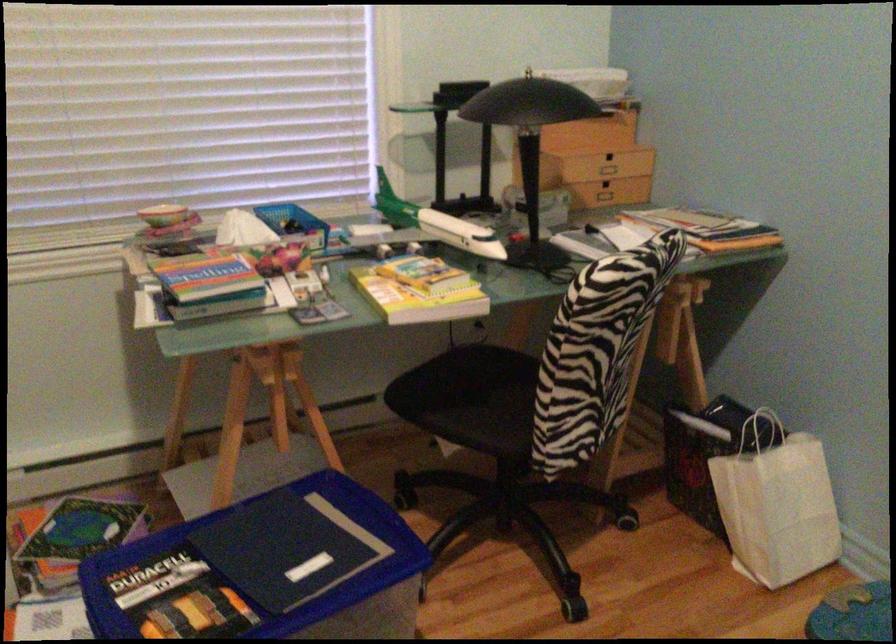
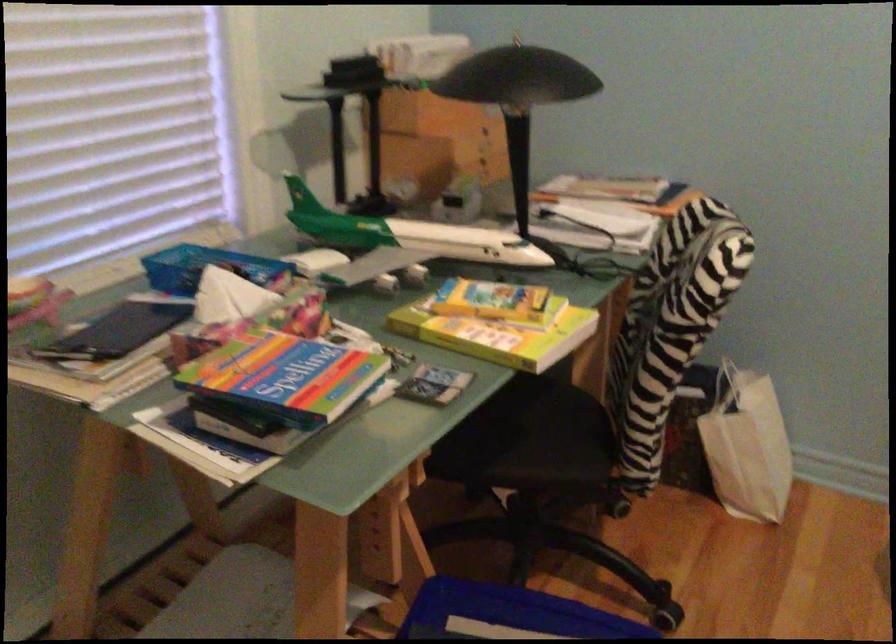
The point at (x=472, y=395) is marked in the first image. Where is the corresponding point in the second image?

(510, 430)